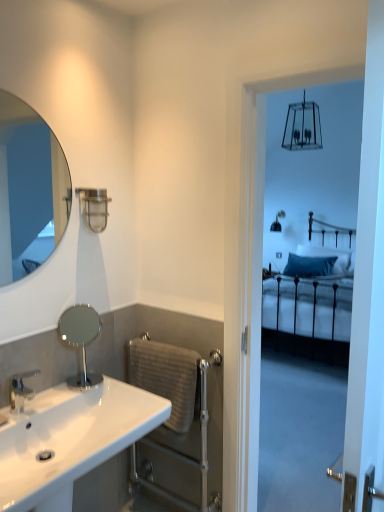
You are a GUI agent. You are given a task and a screenshot of the screen. Output one action in this format:
    pyautogui.click(x=<x>, y=<y>)
    Task: Click on the vacant space situated above silver metallic towel rail at lower center (from a real-world perspective)
    This screenshot has width=384, height=512.
    Given the screenshot: What is the action you would take?
    pyautogui.click(x=182, y=339)